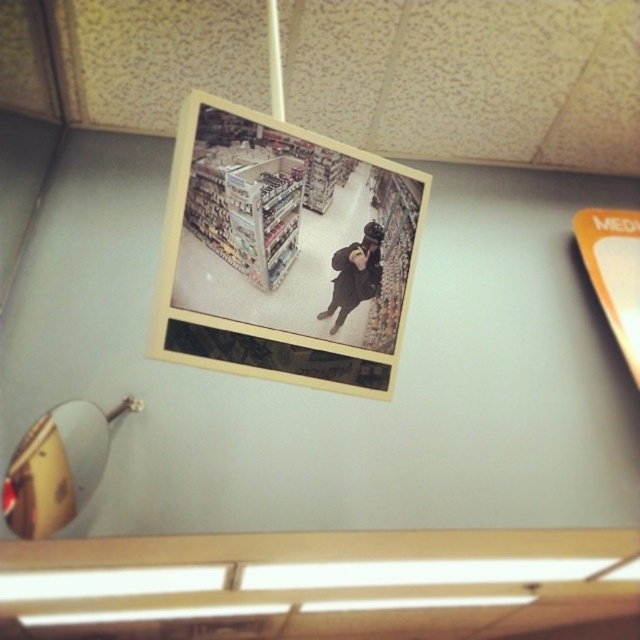
You are organizing a photo album and notice the yellow matte photo frame at center and the matte black jacket at center in the image. Which object is positioned more to the left side?

The yellow matte photo frame at center is positioned more to the left side than the matte black jacket at center.

You are arranging items on a desk and want to place a small plant between the yellow matte photo frame at center and the gold metallic lamp at lower left. Based on their positions, which item should the plant be closer to?

The yellow matte photo frame at center is closer to the viewer than the gold metallic lamp at lower left, so the plant should be placed closer to the gold metallic lamp at lower left to maintain equal distance from both items.

You are organizing a photo display and need to know the relative sizes of the items in the image. Which object is taller between the yellow matte photo frame at center and the matte black jacket at center?

The yellow matte photo frame at center is taller than the matte black jacket at center according to the description.